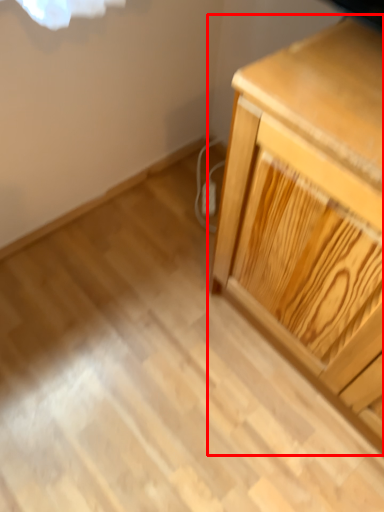
Question: Observing the image, what is the correct spatial positioning of chest of drawers (annotated by the red box) in reference to electric outlet?

Choices:
 (A) right
 (B) left

Answer: (A)